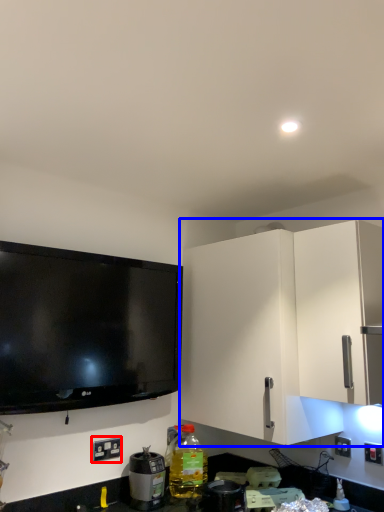
Question: Which object appears closest to the camera in this image, electric outlet (highlighted by a red box) or cabinetry (highlighted by a blue box)?

Choices:
 (A) electric outlet
 (B) cabinetry

Answer: (B)